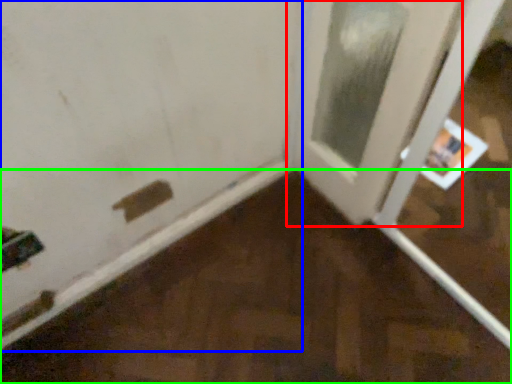
Question: Estimate the real-world distances between objects in this image. Which object is farther from door (highlighted by a red box), door (highlighted by a blue box) or plywood (highlighted by a green box)?

Choices:
 (A) door
 (B) plywood

Answer: (B)